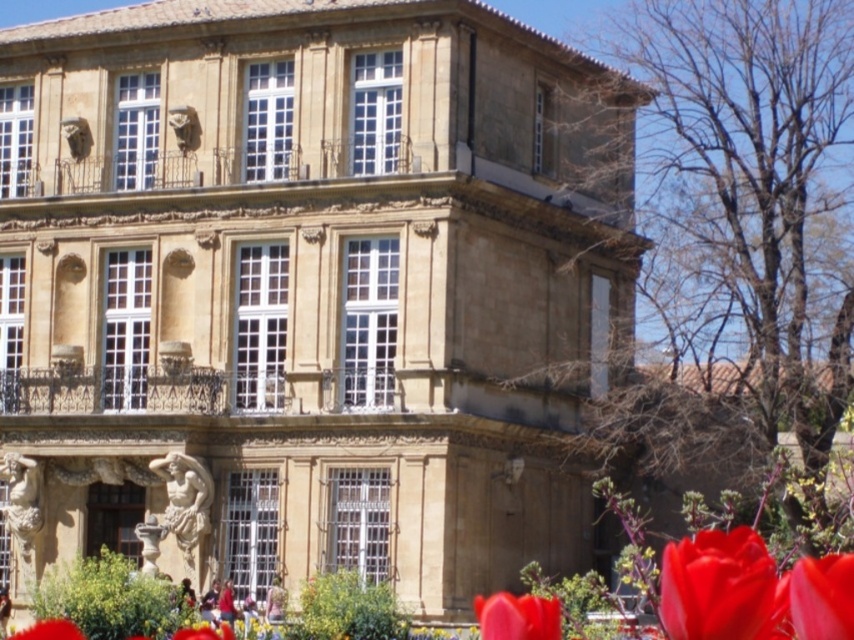
Can you confirm if smooth glossy red flower at lower right is shorter than smooth red petal at lower left?

In fact, smooth glossy red flower at lower right may be taller than smooth red petal at lower left.

Is smooth glossy red flower at lower right wider than smooth red petal at lower left?

Yes.

Locate an element on the screen. smooth glossy red flower at lower right is located at coordinates (722, 588).

Where is `smooth glossy red flower at lower right`? Image resolution: width=854 pixels, height=640 pixels. smooth glossy red flower at lower right is located at coordinates (722, 588).

Between glossy red tulip at lower right and smooth red petal at lower left, which one has less height?

Standing shorter between the two is smooth red petal at lower left.

Is glossy red tulip at lower right positioned in front of smooth red petal at lower left?

Yes, glossy red tulip at lower right is in front of smooth red petal at lower left.

Between point (512, 634) and point (33, 637), which one is positioned in front?

Point (512, 634) is in front.

Locate an element on the screen. This screenshot has width=854, height=640. glossy red tulip at lower right is located at coordinates click(518, 616).

Which is more to the right, smooth glossy red flower at lower right or glossy red tulip at lower right?

Positioned to the right is smooth glossy red flower at lower right.

Does smooth glossy red flower at lower right appear under glossy red tulip at lower right?

Incorrect, smooth glossy red flower at lower right is not positioned below glossy red tulip at lower right.

Describe the element at coordinates (722, 588) in the screenshot. I see `smooth glossy red flower at lower right` at that location.

Where is `smooth glossy red flower at lower right`? The width and height of the screenshot is (854, 640). smooth glossy red flower at lower right is located at coordinates (722, 588).